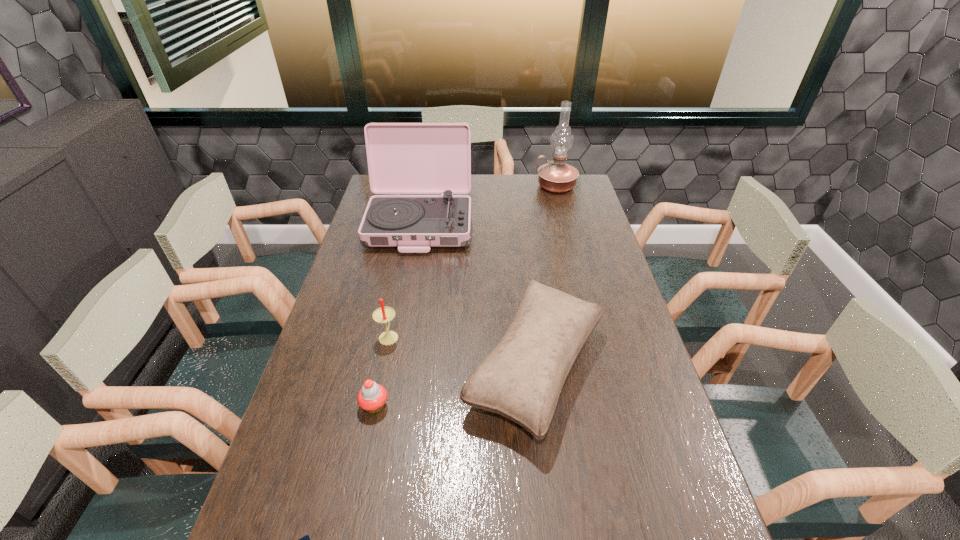
Identify the location of oil lamp present at the far edge. (556, 176).

At what (x,y) coordinates should I click in order to perform the action: click on record player that is positioned at the far edge. Please return your answer as a coordinate pair (x, y). The width and height of the screenshot is (960, 540). Looking at the image, I should click on (x=403, y=158).

Find the location of a particular element. Image resolution: width=960 pixels, height=540 pixels. record player that is at the left edge is located at coordinates (403, 158).

Find the location of `cupcake that is positioned at the left edge`. cupcake that is positioned at the left edge is located at coordinates (372, 396).

I want to click on oil lamp at the right edge, so click(556, 176).

Where is `cushion that is at the right edge`? cushion that is at the right edge is located at coordinates (521, 379).

Where is `object located at the far left corner`? This screenshot has height=540, width=960. object located at the far left corner is located at coordinates (403, 158).

Where is `object that is at the far right corner`? This screenshot has width=960, height=540. object that is at the far right corner is located at coordinates click(x=556, y=176).

The height and width of the screenshot is (540, 960). What are the coordinates of `free spot at the far edge of the desktop` in the screenshot? It's located at (477, 189).

In the image, there is a desktop. What are the coordinates of `vacant space at the left edge` in the screenshot? It's located at (392, 266).